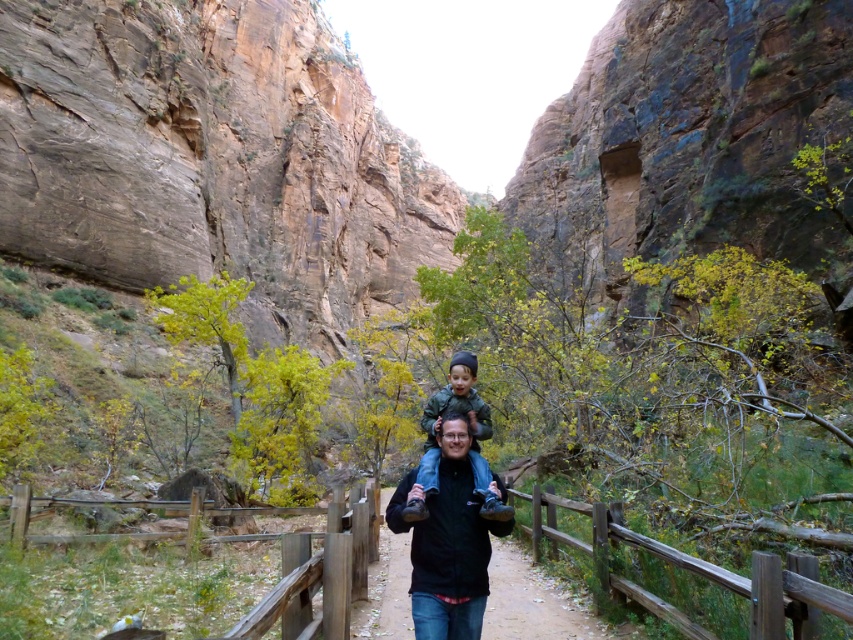
Question: Which point appears farthest from the camera in this image?

Choices:
 (A) (515, 612)
 (B) (483, 422)

Answer: (B)

Question: Where is black matte jacket at center located in relation to green fabric jacket at center in the image?

Choices:
 (A) above
 (B) below

Answer: (B)

Question: Where is brown wooden trail at center located in relation to green fabric jacket at center in the image?

Choices:
 (A) left
 (B) right

Answer: (A)

Question: Which object is positioned closest to the green fabric jacket at center?

Choices:
 (A) brown wooden trail at center
 (B) black matte jacket at center

Answer: (B)

Question: Which point is farther to the camera?

Choices:
 (A) (485, 538)
 (B) (413, 499)
 (C) (357, 627)

Answer: (C)

Question: Is brown wooden trail at center smaller than green fabric jacket at center?

Choices:
 (A) no
 (B) yes

Answer: (A)